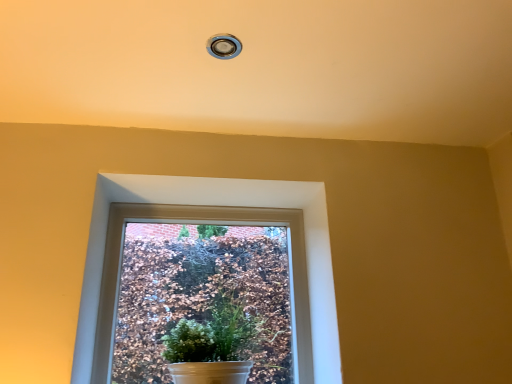
Where is `white glossy window at center`? The height and width of the screenshot is (384, 512). white glossy window at center is located at coordinates pyautogui.click(x=224, y=205).

Describe the element at coordinates (224, 205) in the screenshot. Image resolution: width=512 pixels, height=384 pixels. I see `white glossy window at center` at that location.

The image size is (512, 384). What do you see at coordinates (216, 344) in the screenshot? I see `white matte pot at center` at bounding box center [216, 344].

You are a GUI agent. You are given a task and a screenshot of the screen. Output one action in this format:
    pyautogui.click(x=<x>, y=<y>)
    Task: Click on the white matte pot at center
    The height and width of the screenshot is (384, 512).
    Given the screenshot: What is the action you would take?
    pyautogui.click(x=216, y=344)

You are a GUI agent. You are given a task and a screenshot of the screen. Output one action in this format:
    pyautogui.click(x=<x>, y=<y>)
    Task: Click on the white glossy window at center
    The width and height of the screenshot is (512, 384).
    Given the screenshot: What is the action you would take?
    pyautogui.click(x=224, y=205)

Which object is positioned more to the right, white glossy window at center or white matte pot at center?

white matte pot at center.

Between white glossy window at center and white matte pot at center, which one is positioned in front?

white matte pot at center is in front.

Between point (138, 190) and point (243, 316), which one is positioned in front?

The point (243, 316) is in front.

From the image's perspective, would you say white glossy window at center is shown under white matte pot at center?

No, from the image's perspective, white glossy window at center is not below white matte pot at center.

From a real-world perspective, who is located higher, white glossy window at center or white matte pot at center?

white glossy window at center is physically above.

Considering the relative sizes of white glossy window at center and white matte pot at center in the image provided, is white glossy window at center wider than white matte pot at center?

Incorrect, the width of white glossy window at center does not surpass that of white matte pot at center.

Does white glossy window at center have a lesser height compared to white matte pot at center?

In fact, white glossy window at center may be taller than white matte pot at center.

Consider the image. Considering the relative sizes of white glossy window at center and white matte pot at center in the image provided, is white glossy window at center bigger than white matte pot at center?

Incorrect, white glossy window at center is not larger than white matte pot at center.

Is white glossy window at center situated inside white matte pot at center or outside?

white glossy window at center is outside white matte pot at center.

Is white glossy window at center far away from white matte pot at center?

No, white glossy window at center is in close proximity to white matte pot at center.

Is white glossy window at center turned away from white matte pot at center?

Yes.

How different are the orientations of white glossy window at center and white matte pot at center in degrees?

white glossy window at center and white matte pot at center are facing 1.07 degrees away from each other.

How far apart are white glossy window at center and white matte pot at center?

white glossy window at center is 12.42 inches from white matte pot at center.

Locate an element on the screen. This screenshot has height=384, width=512. houseplant on the right side of white glossy window at center is located at coordinates (216, 344).

Which is more to the left, white matte pot at center or white glossy window at center?

white glossy window at center is more to the left.

Considering their positions, is white matte pot at center located in front of or behind white glossy window at center?

Visually, white matte pot at center is located in front of white glossy window at center.

Which is in front, point (236, 353) or point (90, 317)?

The point (236, 353) is closer to the camera.

From the image's perspective, which is below, white matte pot at center or white glossy window at center?

white matte pot at center.

From a real-world perspective, is white matte pot at center below white glossy window at center?

Yes, from a real-world perspective, white matte pot at center is under white glossy window at center.

Between white matte pot at center and white glossy window at center, which one has larger width?

white matte pot at center is wider.

Consider the image. Can you confirm if white matte pot at center is taller than white glossy window at center?

In fact, white matte pot at center may be shorter than white glossy window at center.

Considering the sizes of objects white matte pot at center and white glossy window at center in the image provided, who is smaller, white matte pot at center or white glossy window at center?

Smaller between the two is white glossy window at center.

Would you say white matte pot at center is outside white glossy window at center?

white matte pot at center lies outside white glossy window at center's area.

Would you say white matte pot at center is a long distance from white glossy window at center?

That's not correct — white matte pot at center is a little close to white glossy window at center.

Is white glossy window at center at the back of white matte pot at center?

Correct, white matte pot at center is looking away from white glossy window at center.

This screenshot has width=512, height=384. I want to click on window behind the white matte pot at center, so click(224, 205).

What are the coordinates of `houseplant lying below the white glossy window at center (from the image's perspective)` in the screenshot? It's located at (216, 344).

Locate an element on the screen. window above the white matte pot at center (from the image's perspective) is located at coordinates click(224, 205).